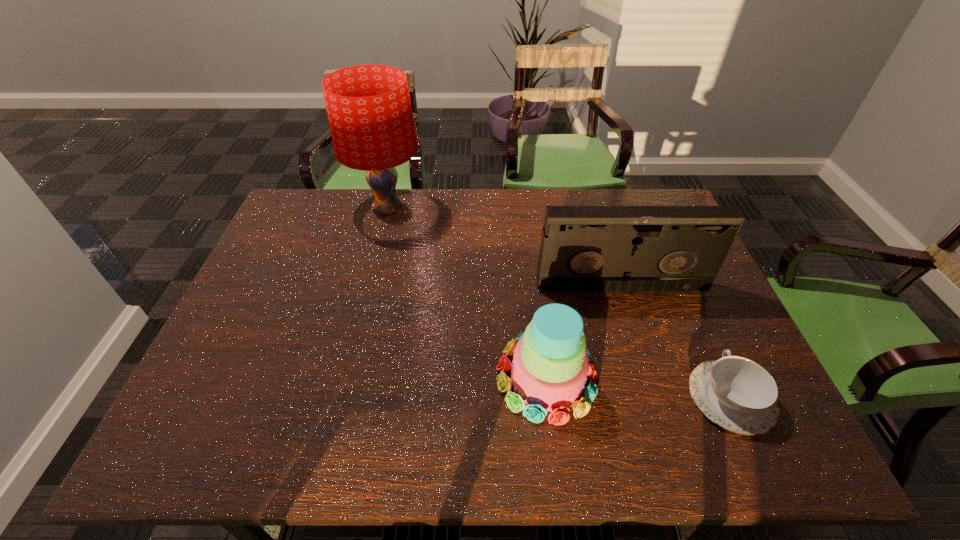
The width and height of the screenshot is (960, 540). Identify the location of vacant region that satisfies the following two spatial constraints: 1. on the handle side of the chinaware; 2. on the front-facing side of the farthest object. (646, 209).

Where is `vacant space that satisfies the following two spatial constraints: 1. on the handle side of the chinaware; 2. on the front-facing side of the tallest object`? vacant space that satisfies the following two spatial constraints: 1. on the handle side of the chinaware; 2. on the front-facing side of the tallest object is located at coordinates (646, 209).